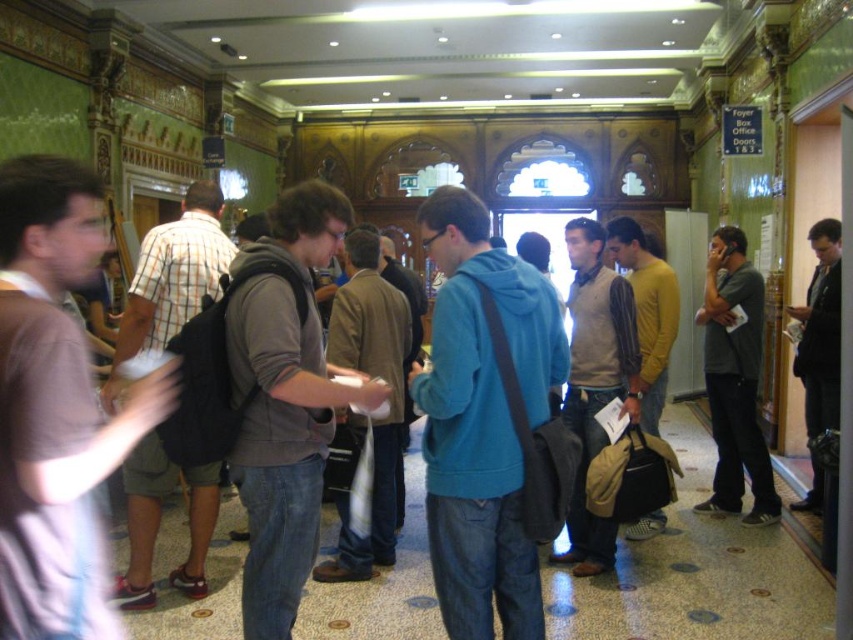
Which is behind, point (271, 529) or point (187, 256)?

The point (187, 256) is more distant.

Can you confirm if gray hoodie at center is positioned to the left of plaid cotton shirt at left?

No, gray hoodie at center is not to the left of plaid cotton shirt at left.

Find the location of `gray hoodie at center`. gray hoodie at center is located at coordinates (286, 403).

The width and height of the screenshot is (853, 640). I want to click on gray hoodie at center, so pyautogui.click(x=286, y=403).

Is gray hoodie at center closer to camera compared to black leather jacket at right?

Yes, it is.

Locate an element on the screen. This screenshot has width=853, height=640. gray hoodie at center is located at coordinates (286, 403).

Where is `gray hoodie at center`? The width and height of the screenshot is (853, 640). gray hoodie at center is located at coordinates (286, 403).

Which is in front, point (627, 321) or point (828, 372)?

Positioned in front is point (627, 321).

Which is below, matte brown sweater at center or black leather jacket at right?

matte brown sweater at center is below.

Identify the location of matte brown sweater at center. This screenshot has height=640, width=853. (595, 380).

At what (x,y) coordinates should I click in order to perform the action: click on matte brown sweater at center. Please return your answer as a coordinate pair (x, y). Image resolution: width=853 pixels, height=640 pixels. Looking at the image, I should click on (595, 380).